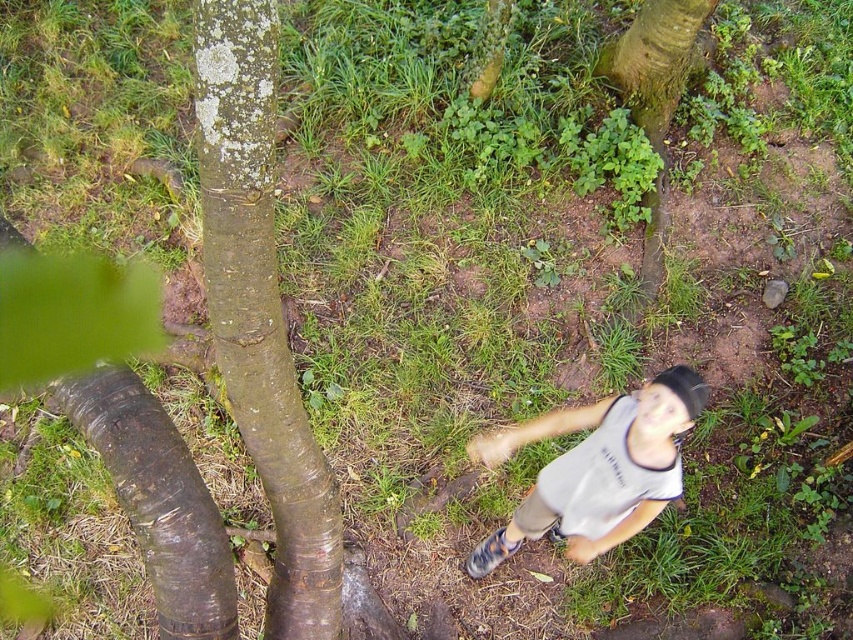
Is brown rough bark at left taller than gray cotton shirt at center?

Correct, brown rough bark at left is much taller as gray cotton shirt at center.

You are a GUI agent. You are given a task and a screenshot of the screen. Output one action in this format:
    pyautogui.click(x=<x>, y=<y>)
    Task: Click on the brown rough bark at left
    
    Given the screenshot: What is the action you would take?
    pyautogui.click(x=260, y=312)

Where is `brown rough bark at left`? The image size is (853, 640). brown rough bark at left is located at coordinates coord(260,312).

Which is in front, point (566, 518) or point (694, 26)?

Point (566, 518) is more forward.

Who is higher up, gray cotton shirt at center or green mossy tree trunk at upper center?

green mossy tree trunk at upper center is above.

Identify the location of gray cotton shirt at center. This screenshot has width=853, height=640. (596, 468).

The width and height of the screenshot is (853, 640). What are the coordinates of `gray cotton shirt at center` in the screenshot? It's located at (596, 468).

Is brown rough bark at left smaller than green mossy tree trunk at upper center?

Indeed, brown rough bark at left has a smaller size compared to green mossy tree trunk at upper center.

Does brown rough bark at left appear under green mossy tree trunk at upper center?

Yes, brown rough bark at left is below green mossy tree trunk at upper center.

Is point (223, 65) behind point (641, 99)?

No, (223, 65) is in front of (641, 99).

Locate an element on the screen. This screenshot has height=640, width=853. brown rough bark at left is located at coordinates (260, 312).